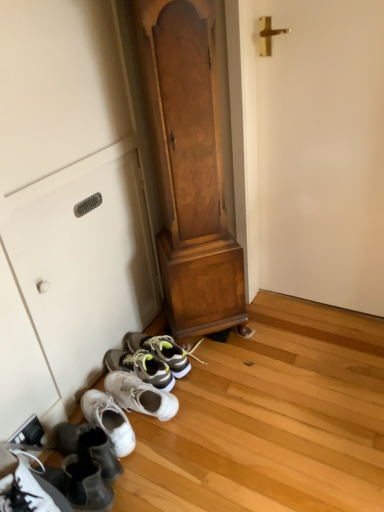
Locate an element on the screen. free point above white matte cabinet at lower left (from a real-world perspective) is located at coordinates (80, 179).